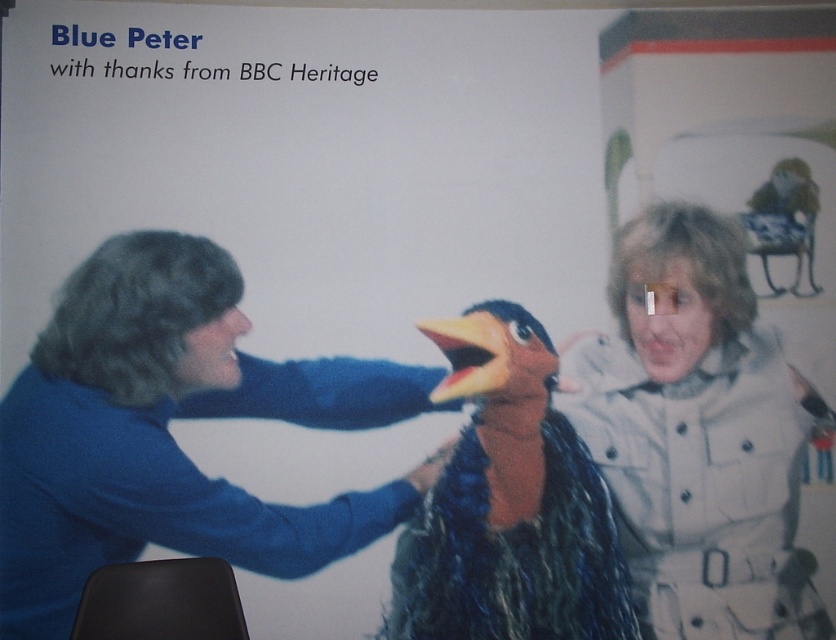
Looking at this image, in the scene described, there is a blue velvet sweater at left and a fuzzy brown penguin at center. Which object takes up more space in the image?

The blue velvet sweater at left is larger in size than the fuzzy brown penguin at center, so it takes up more space in the image.

You are a costume designer preparing for a puppet show. You need to place the light beige textured coat at right and the fuzzy brown penguin at center on a rack. According to the scene, which item should be placed higher on the rack?

The light beige textured coat at right should be placed higher on the rack because it is taller than the fuzzy brown penguin at center.

You are a costume designer preparing for a play and need to arrange the blue velvet sweater at left and the fuzzy brown penguin at center on a rack. Based on their positions in the image, which item should you place closer to the front of the rack?

The blue velvet sweater at left should be placed closer to the front of the rack because it is in front of the fuzzy brown penguin at center in the image.